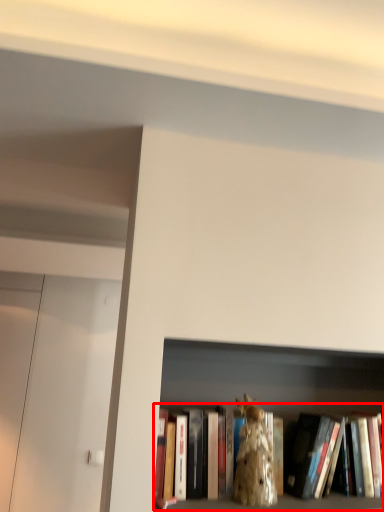
Question: In this image, where is book (annotated by the red box) located relative to animal?

Choices:
 (A) right
 (B) left

Answer: (A)